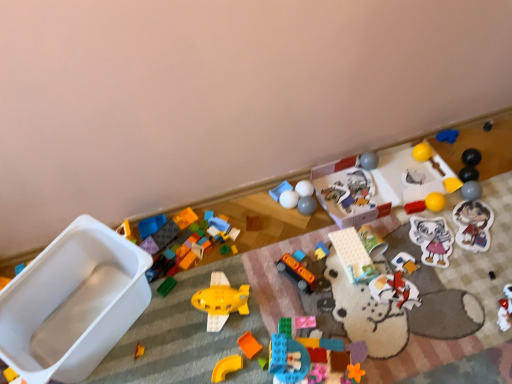
The height and width of the screenshot is (384, 512). In order to click on free area in between matte plastic stickers at lower right, the 23th toy viewed from the left, and white glossy sticker at center-right, which is counted as the sixth toy, starting from the right in this screenshot , I will do `click(452, 238)`.